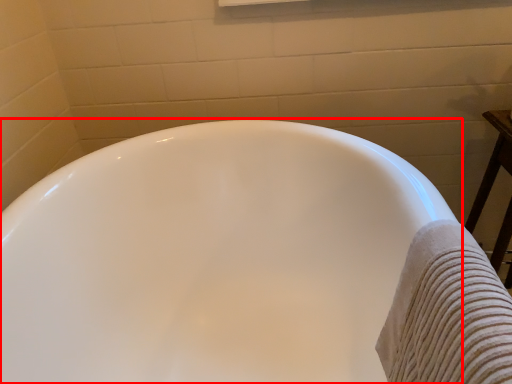
Question: From the image's perspective, what is the correct spatial relationship of bathtub (annotated by the red box) in relation to bath towel?

Choices:
 (A) below
 (B) above

Answer: (A)